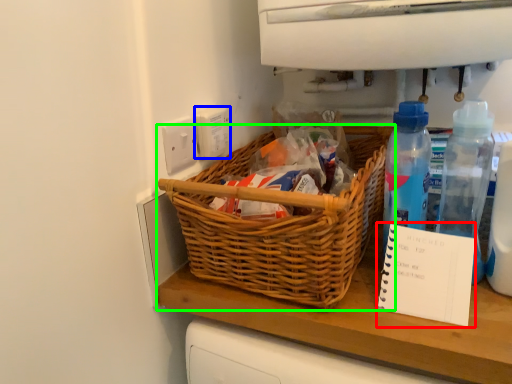
Question: Estimate the real-world distances between objects in this image. Which object is closer to notebook (highlighted by a red box), electric outlet (highlighted by a blue box) or picnic basket (highlighted by a green box)?

Choices:
 (A) electric outlet
 (B) picnic basket

Answer: (B)